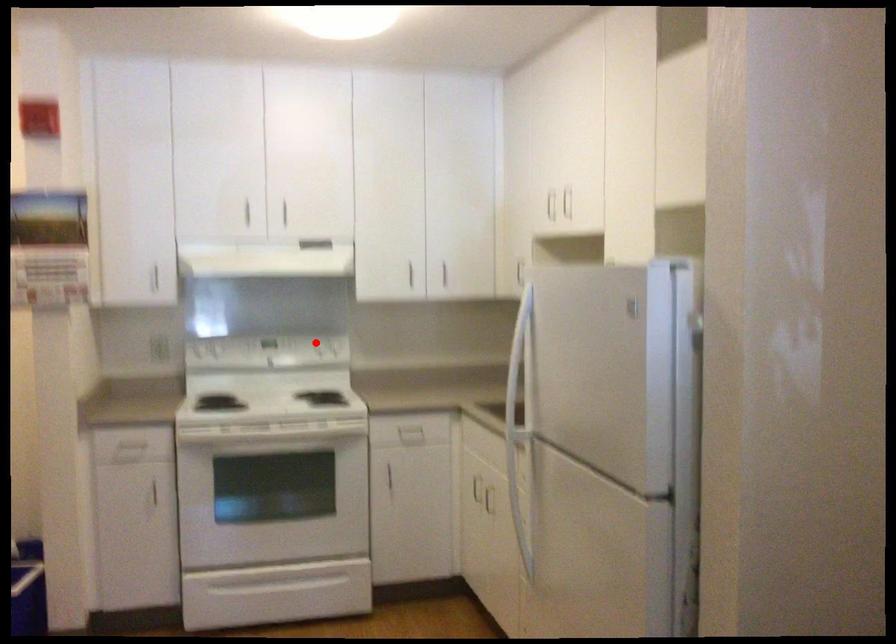
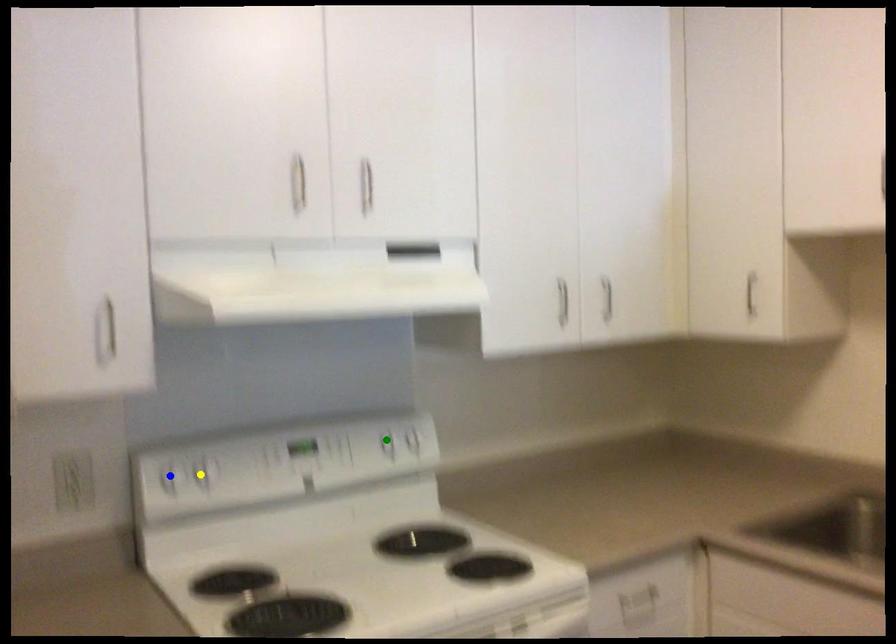
Question: I am providing you with two images of the same scene from different viewpoints. A red point is marked on the first image. You are given multiple points on the second image. Which point in image 2 represents the same 3d spot as the red point in image 1?

Choices:
 (A) green point
 (B) blue point
 (C) yellow point

Answer: (A)